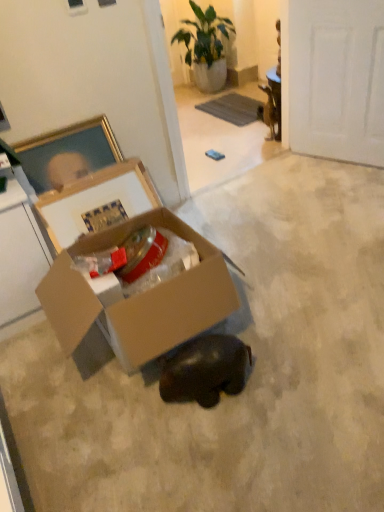
Question: Is the surface of shiny black elephant at center in direct contact with cardboard box at center?

Choices:
 (A) yes
 (B) no

Answer: (B)

Question: Considering the relative sizes of shiny black elephant at center and cardboard box at center in the image provided, is shiny black elephant at center smaller than cardboard box at center?

Choices:
 (A) no
 (B) yes

Answer: (B)

Question: Is the depth of shiny black elephant at center greater than that of cardboard box at center?

Choices:
 (A) yes
 (B) no

Answer: (A)

Question: From the image's perspective, is shiny black elephant at center above cardboard box at center?

Choices:
 (A) no
 (B) yes

Answer: (A)

Question: Is shiny black elephant at center aimed at cardboard box at center?

Choices:
 (A) no
 (B) yes

Answer: (A)

Question: Is shiny black elephant at center completely or partially outside of cardboard box at center?

Choices:
 (A) no
 (B) yes

Answer: (B)

Question: Can you confirm if green leafy plant at upper center is positioned to the right of white matte door at upper right?

Choices:
 (A) no
 (B) yes

Answer: (A)

Question: Does green leafy plant at upper center have a larger size compared to white matte door at upper right?

Choices:
 (A) no
 (B) yes

Answer: (B)

Question: Are green leafy plant at upper center and white matte door at upper right beside each other?

Choices:
 (A) yes
 (B) no

Answer: (B)

Question: Is green leafy plant at upper center facing towards white matte door at upper right?

Choices:
 (A) no
 (B) yes

Answer: (A)

Question: Is green leafy plant at upper center positioned behind white matte door at upper right?

Choices:
 (A) no
 (B) yes

Answer: (B)

Question: From the image's perspective, would you say green leafy plant at upper center is shown under white matte door at upper right?

Choices:
 (A) yes
 (B) no

Answer: (B)

Question: Can you confirm if cardboard box at center is positioned to the left of green leafy plant at upper center?

Choices:
 (A) yes
 (B) no

Answer: (A)